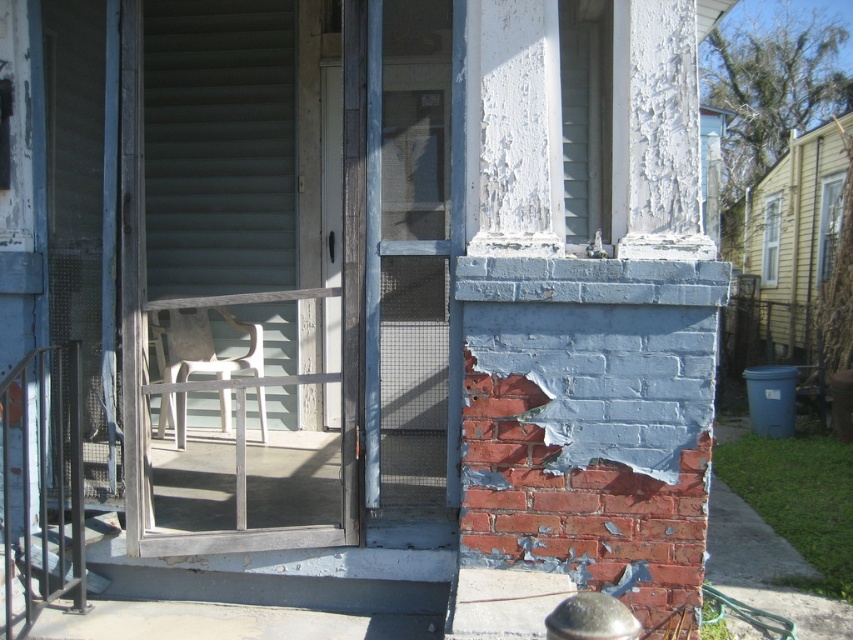
Question: Among these points, which one is farthest from the camera?

Choices:
 (A) (160, 374)
 (B) (136, 170)

Answer: (A)

Question: Which object is farther from the camera taking this photo?

Choices:
 (A) white plastic chair at center
 (B) gray wood screen door at center

Answer: (A)

Question: Is gray wood screen door at center to the left of white plastic chair at center from the viewer's perspective?

Choices:
 (A) no
 (B) yes

Answer: (A)

Question: Is gray wood screen door at center below white plastic chair at center?

Choices:
 (A) no
 (B) yes

Answer: (A)

Question: Can you confirm if gray wood screen door at center is thinner than white plastic chair at center?

Choices:
 (A) yes
 (B) no

Answer: (B)

Question: Among these objects, which one is farthest from the camera?

Choices:
 (A) white plastic chair at center
 (B) gray wood screen door at center

Answer: (A)